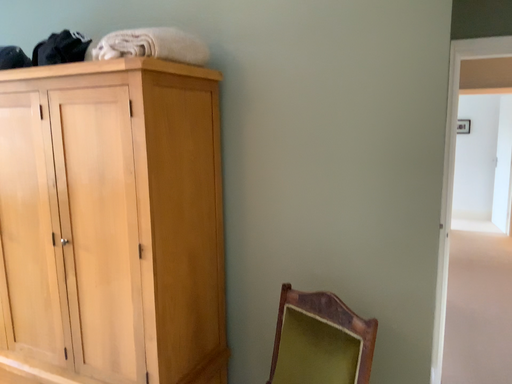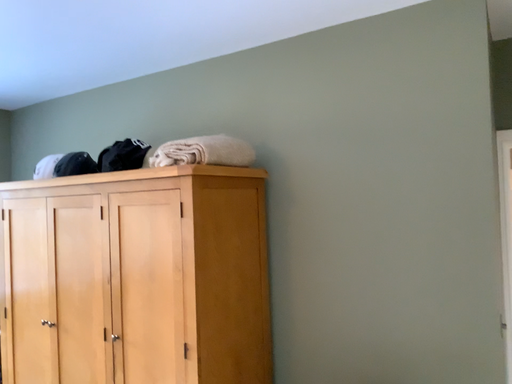
Question: How did the camera likely rotate when shooting the video?

Choices:
 (A) rotated left
 (B) rotated right

Answer: (A)